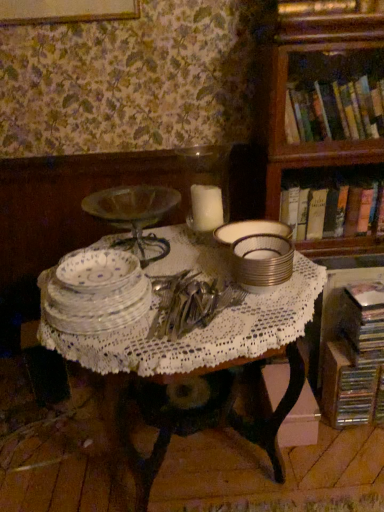
Where is `free point above clear glass plates at center, placed as the second tableware when sorted from right to left (from a real-world perspective)`? free point above clear glass plates at center, placed as the second tableware when sorted from right to left (from a real-world perspective) is located at coordinates (102, 278).